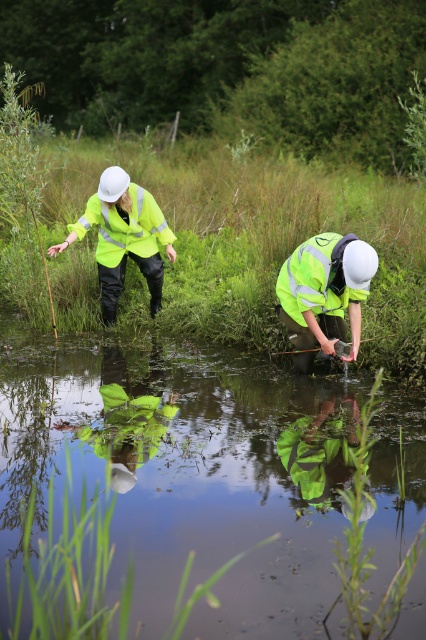
Question: Which is farther from the high-visibility yellow jacket at center?

Choices:
 (A) high-visibility fabric safety vest at lower right
 (B) high-visibility fabric safety vest at upper left
 (C) high-visibility fabric worker at lower center
 (D) transparent plastic stream at center

Answer: (D)

Question: Can you confirm if high-visibility fabric safety vest at upper left is positioned to the left of high-visibility fabric safety vest at lower right?

Choices:
 (A) no
 (B) yes

Answer: (B)

Question: Among these points, which one is nearest to the camera?

Choices:
 (A) (324, 264)
 (B) (302, 259)
 (C) (132, 208)
 (D) (408, 627)

Answer: (D)

Question: Can you confirm if high-visibility fabric safety vest at upper left is wider than high-visibility fabric safety vest at lower right?

Choices:
 (A) yes
 (B) no

Answer: (A)

Question: Is transparent plastic stream at center to the left of high-visibility fabric worker at lower center from the viewer's perspective?

Choices:
 (A) yes
 (B) no

Answer: (A)

Question: Among these points, which one is nearest to the camera?

Choices:
 (A) (307, 262)
 (B) (169, 252)
 (C) (114, 205)

Answer: (A)